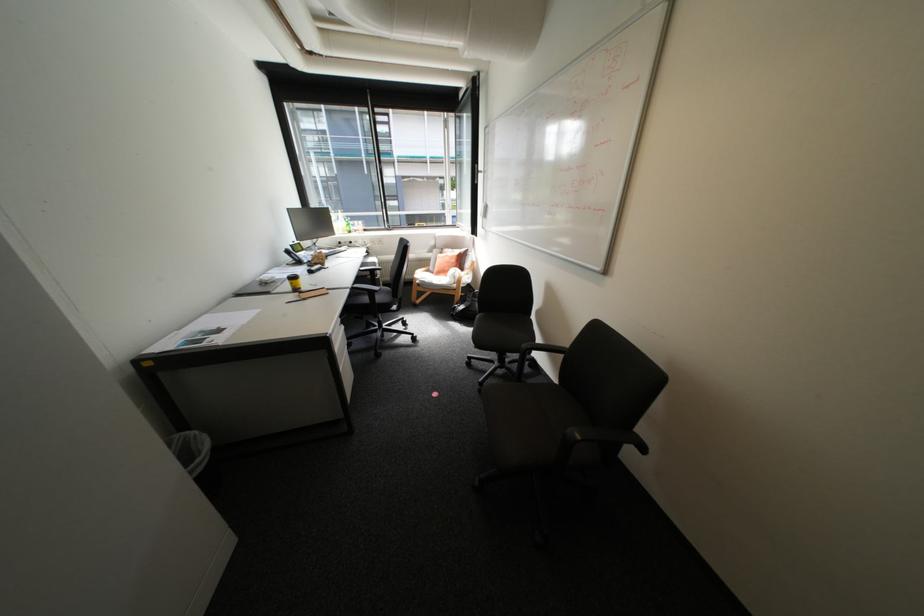
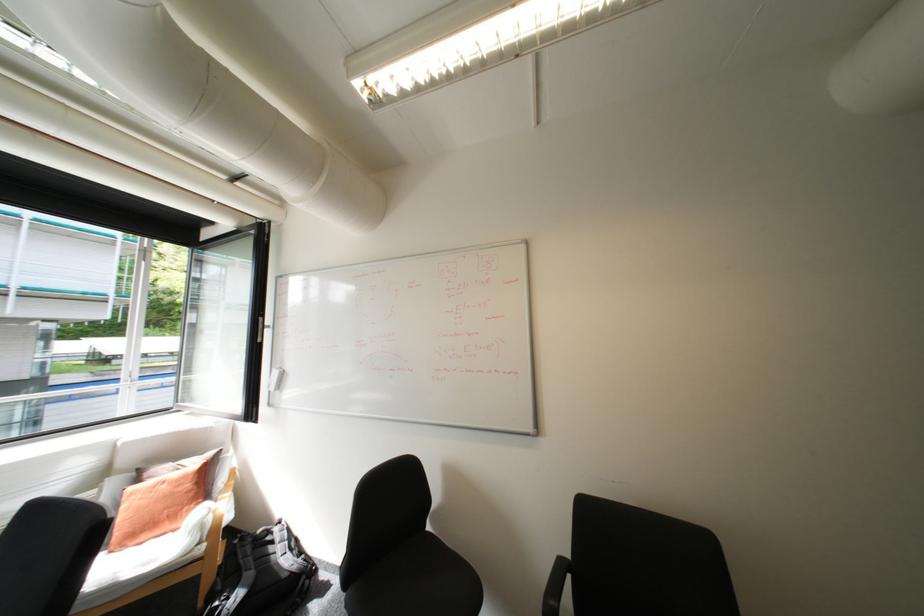
In the second image, find the point that corresponds to (456,257) in the first image.

(175, 485)